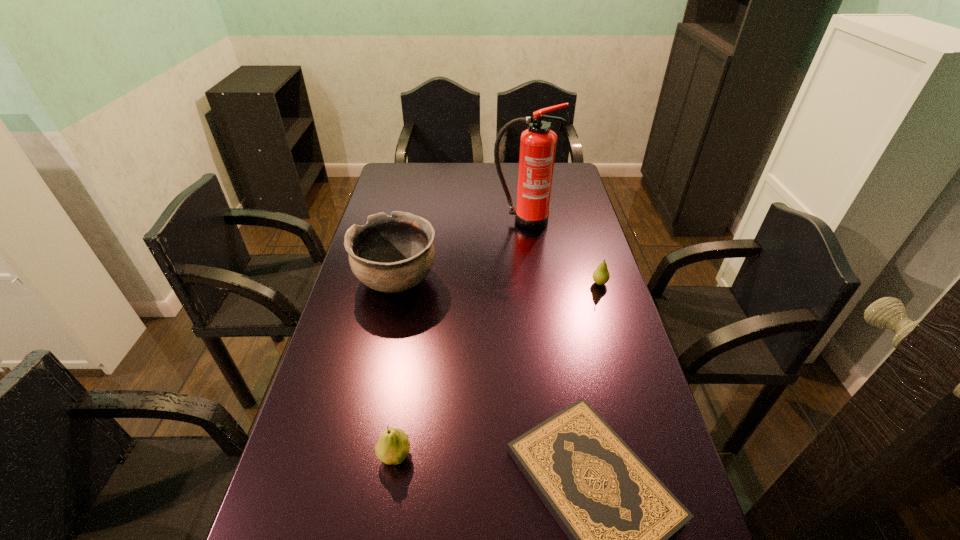
Locate an element on the screen. fire extinguisher located at the right edge is located at coordinates (537, 143).

Locate an element on the screen. pear at the right edge is located at coordinates (601, 275).

The width and height of the screenshot is (960, 540). Identify the location of free spot at the far edge of the desktop. (425, 167).

Locate an element on the screen. vacant area at the left edge is located at coordinates (372, 350).

Image resolution: width=960 pixels, height=540 pixels. I want to click on free space at the right edge, so click(585, 256).

Identify the location of vacant region at the far left corner of the desktop. The width and height of the screenshot is (960, 540). (394, 179).

Locate an element on the screen. free space at the far right corner of the desktop is located at coordinates (560, 183).

Where is `vacant region between the second tallest object and the left pear`? vacant region between the second tallest object and the left pear is located at coordinates pos(396,368).

Identify the location of vacant area between the farther pear and the nearer pear. The height and width of the screenshot is (540, 960). (497, 369).

In order to click on unoccupied area between the tallest object and the nearer pear in this screenshot , I will do (459, 339).